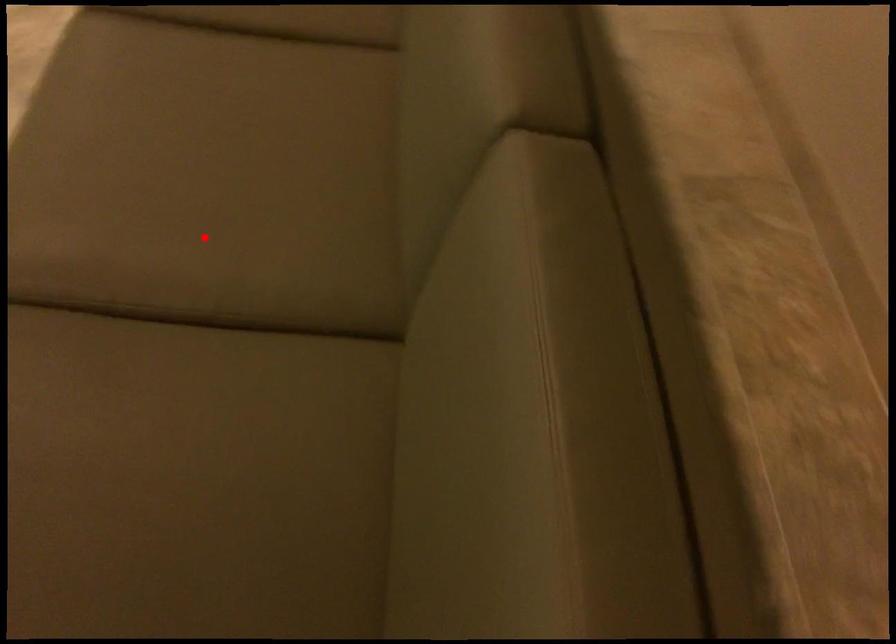
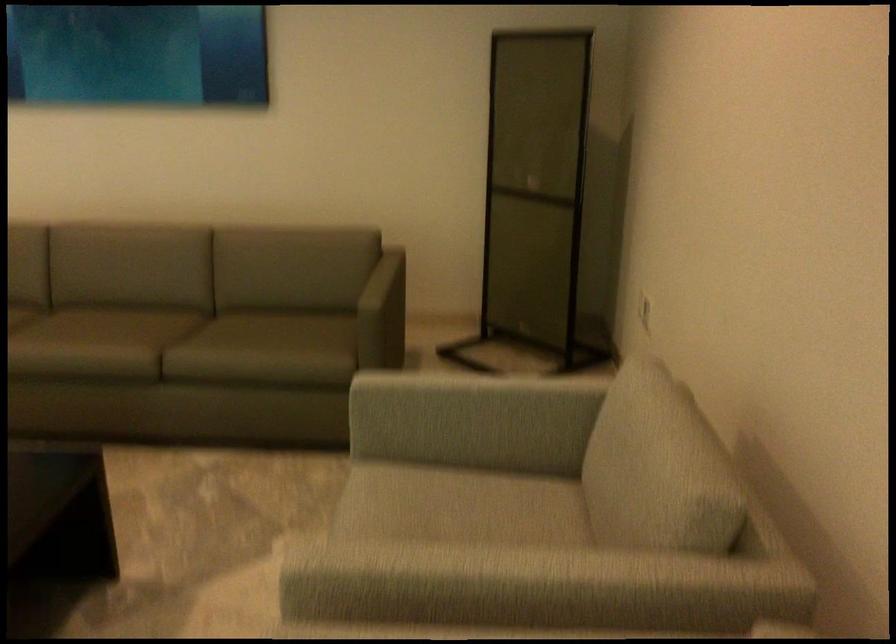
The point at the highlighted location is marked in the first image. Where is the corresponding point in the second image?

(128, 327)